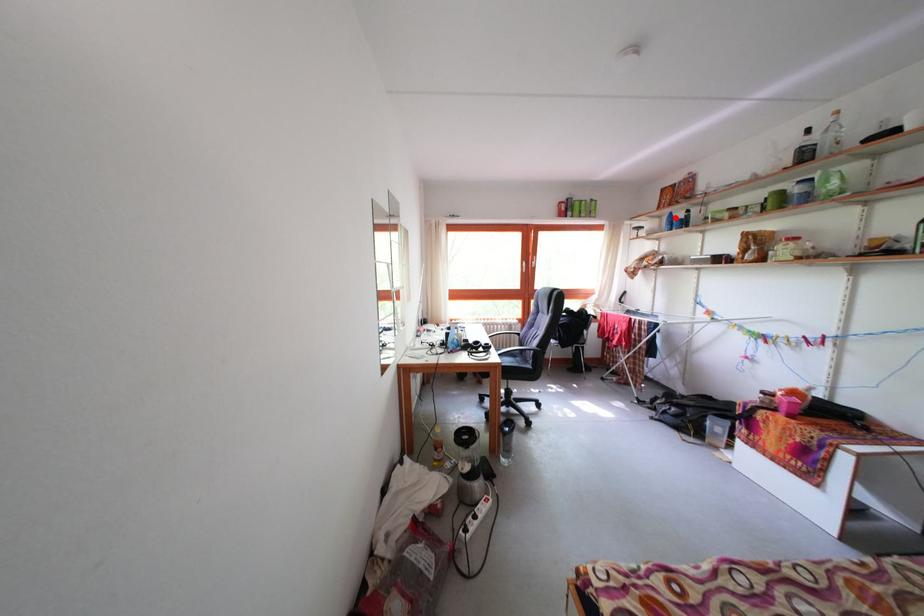
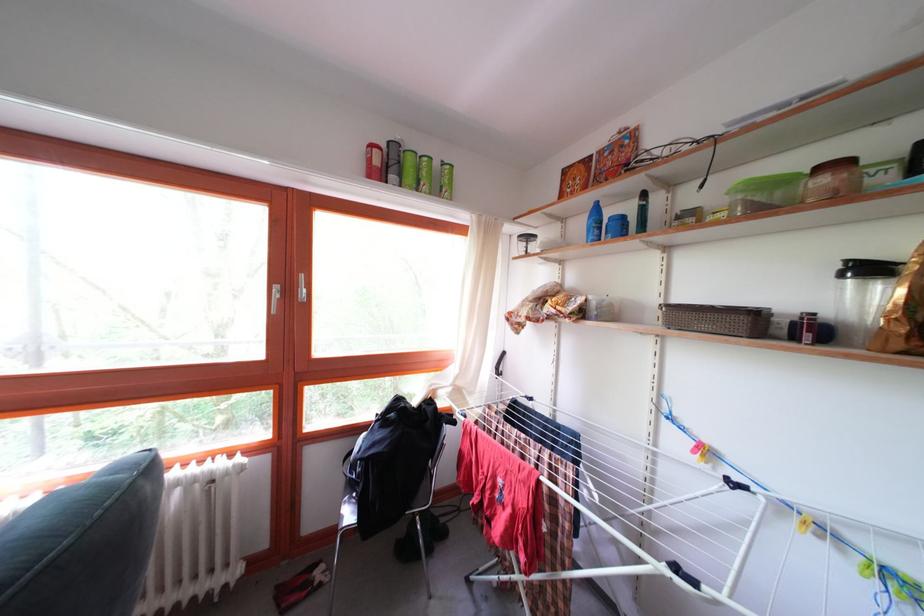
The point at the highlighted location is marked in the first image. Where is the corresponding point in the second image?

(598, 204)